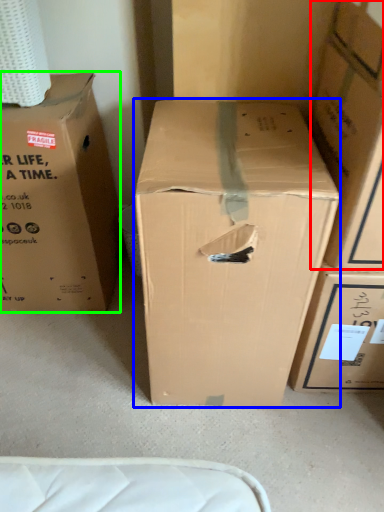
Question: Which is nearer to the box (highlighted by a red box)? box (highlighted by a blue box) or box (highlighted by a green box).

Choices:
 (A) box
 (B) box

Answer: (A)